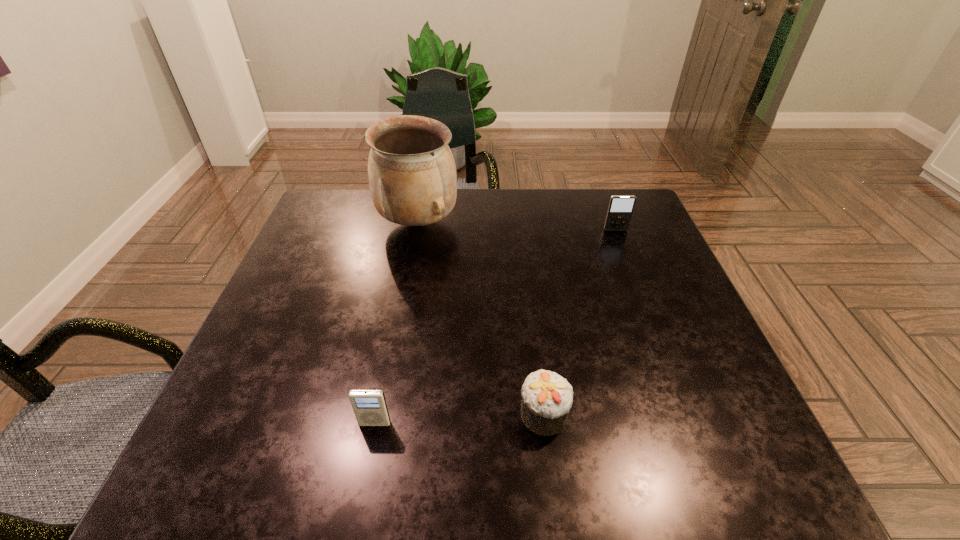
Identify the location of vacant point located between the left iPod and the cupcake. This screenshot has height=540, width=960. (460, 418).

The image size is (960, 540). I want to click on free space between the right iPod and the urn, so click(x=516, y=227).

The image size is (960, 540). Identify the location of vacant point located between the rightmost object and the third object from left to right. (580, 322).

I want to click on free space between the urn and the rightmost object, so click(516, 227).

The image size is (960, 540). What are the coordinates of `vacant area that lies between the urn and the left iPod` in the screenshot? It's located at (396, 323).

Where is `free spot between the left iPod and the urn`? This screenshot has height=540, width=960. free spot between the left iPod and the urn is located at coordinates (396, 323).

Identify the location of vacant area between the second object from right to left and the nearer iPod. The width and height of the screenshot is (960, 540). (460, 418).

This screenshot has height=540, width=960. In order to click on vacant point located between the third object from left to right and the nearer iPod in this screenshot , I will do `click(460, 418)`.

This screenshot has width=960, height=540. In order to click on free spot between the farther iPod and the urn in this screenshot , I will do `click(516, 227)`.

Identify which object is the third nearest to the tallest object. Please provide its 2D coordinates. Your answer should be formatted as a tuple, i.e. [(x, y)], where the tuple contains the x and y coordinates of a point satisfying the conditions above.

[(369, 406)]